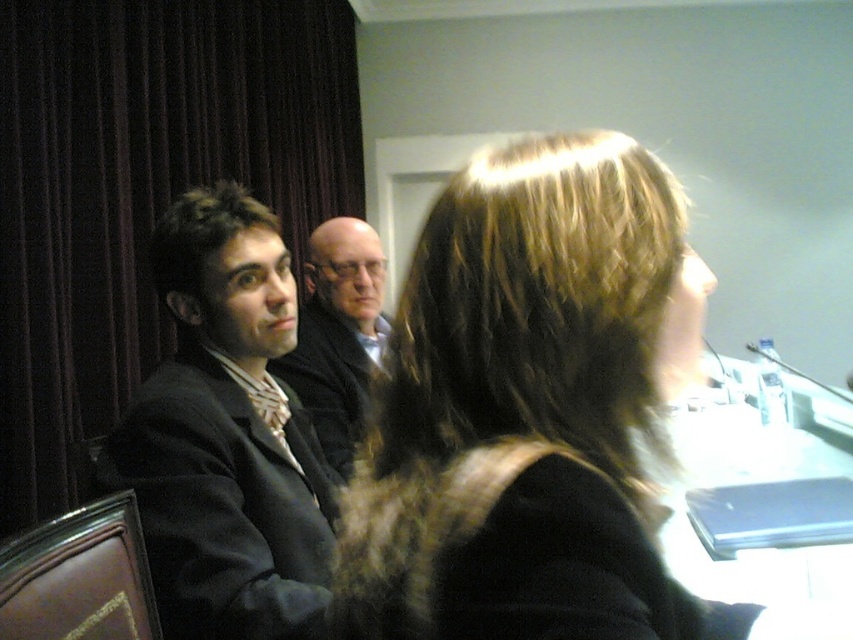
Who is lower down, dark velvet curtain at left or dark brown textured hair at left?

dark brown textured hair at left is below.

This screenshot has width=853, height=640. What do you see at coordinates (140, 189) in the screenshot? I see `dark velvet curtain at left` at bounding box center [140, 189].

In order to click on dark velvet curtain at left in this screenshot , I will do `click(140, 189)`.

Who is higher up, matte black suit at center or dark brown textured hair at left?

dark brown textured hair at left is above.

Does matte black suit at center appear under dark brown textured hair at left?

Correct, matte black suit at center is located below dark brown textured hair at left.

Does point (322, 284) come in front of point (207, 218)?

No, (322, 284) is behind (207, 218).

You are a GUI agent. You are given a task and a screenshot of the screen. Output one action in this format:
    pyautogui.click(x=<x>, y=<y>)
    Task: Click on the matte black suit at center
    This screenshot has height=640, width=853.
    Given the screenshot: What is the action you would take?
    point(337,333)

Can you confirm if white glossy table at lower right is positioned to the left of dark brown textured hair at left?

Incorrect, white glossy table at lower right is not on the left side of dark brown textured hair at left.

Between point (850, 593) and point (218, 189), which one is positioned behind?

Point (850, 593)

Is point (695, 541) farther from camera compared to point (161, 300)?

Yes, it is behind point (161, 300).

Where is `white glossy table at lower right`? The height and width of the screenshot is (640, 853). white glossy table at lower right is located at coordinates (762, 586).